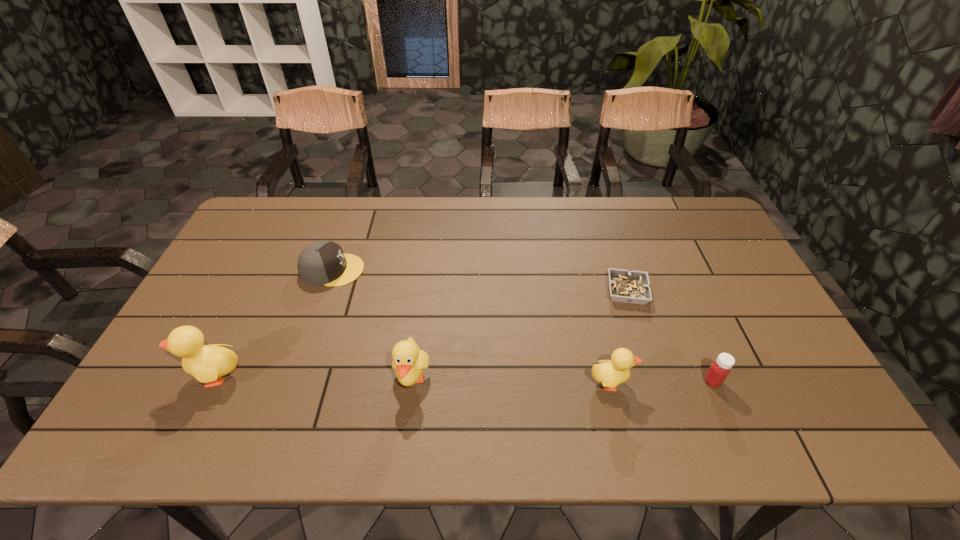
You are a GUI agent. You are given a task and a screenshot of the screen. Output one action in this format:
    pyautogui.click(x=<x>, y=<y>)
    Task: Click on the vacant place for an extra duckling on the right
    Image resolution: width=960 pixels, height=540 pixels.
    Given the screenshot: What is the action you would take?
    pyautogui.click(x=811, y=386)